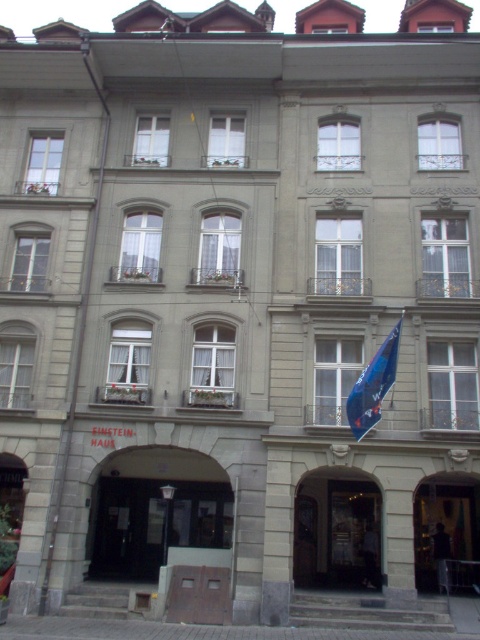
You are a delivery person standing at the entrance of the building. You need to deliver a package to the Einstein Haus located at the ground floor. The entrance to Einstein Haus is the matte glass door at center. However, there is a blue fabric flag at center blocking the path. The flag is 1.5 meters wide. Can you walk around the flag to reach the door without moving the flag?

The distance between the matte glass door at center and the blue fabric flag at center is 8.66 meters. Since the flag is only 1.5 meters wide, you can easily walk around it to reach the door without moving the flag.

You are a delivery person trying to enter the building through the entrance. The entrance is the one with the blue fabric flag at center. However, there is a matte glass door at lower right nearby. Since you have a large package, you need to know which entrance is wider. Which entrance has a greater width?

The blue fabric flag at center has a greater width than the matte glass door at lower right.

You are a tourist standing in front of the building. You want to enter the establishment labeled as Einstein Haus. Which object should you approach first, the matte glass door at lower right or the blue fabric flag at center?

The matte glass door at lower right is further to the viewer than the blue fabric flag at center, so you should approach the matte glass door at lower right first to enter the Einstein Haus.